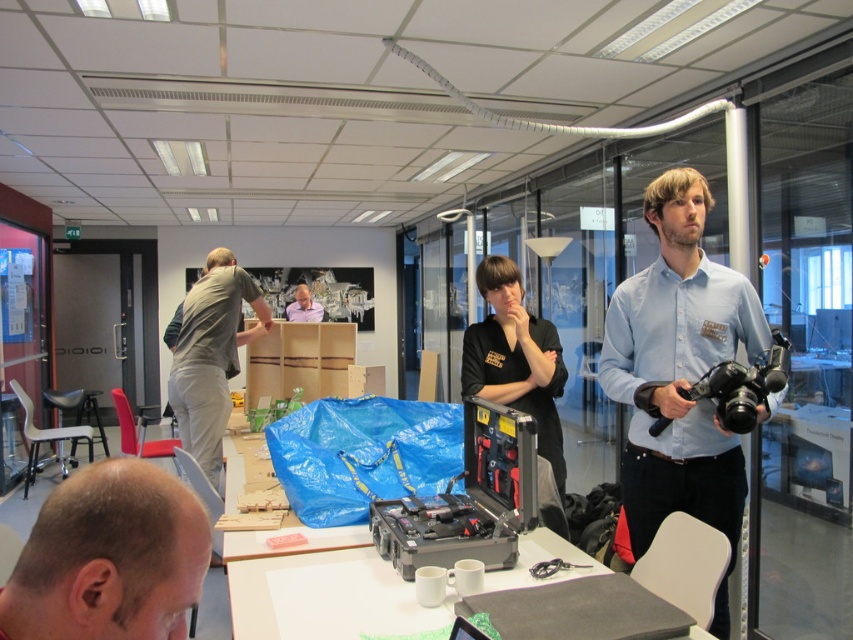
Based on the scene description, which object is wider between the gray cotton shirt at upper left and the matte white shirt at center?

The gray cotton shirt at upper left is wider than the matte white shirt at center according to the description.

You are an office worker who needs to place a new item on the table. The item is too heavy to lift, so you must slide it from the toolbox. Can you slide the item from the black plastic toolbox at center to the white matte table at center?

The white matte table at center is located below the black plastic toolbox at center, so yes, you can slide the item from the black plastic toolbox at center to the white matte table at center since it is positioned directly beneath it.

You are standing at the entrance of the office and want to locate the white matte table at center. According to the coordinates provided, where would you find it?

The white matte table at center is located at coordinates point (325,596).